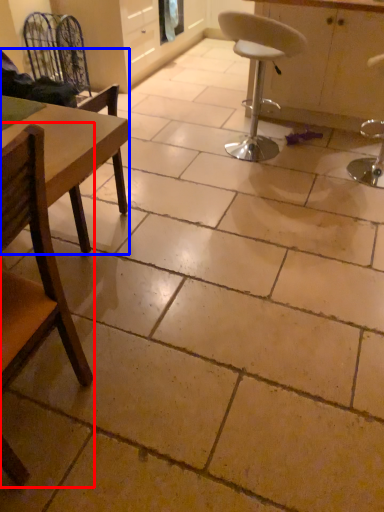
Question: Among these objects, which one is farthest to the camera, chair (highlighted by a red box) or chair (highlighted by a blue box)?

Choices:
 (A) chair
 (B) chair

Answer: (B)